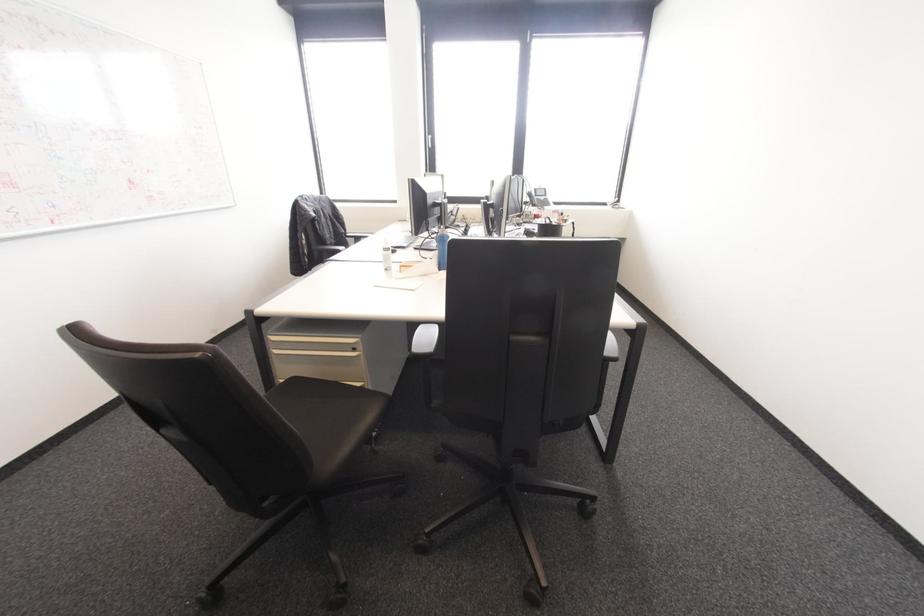
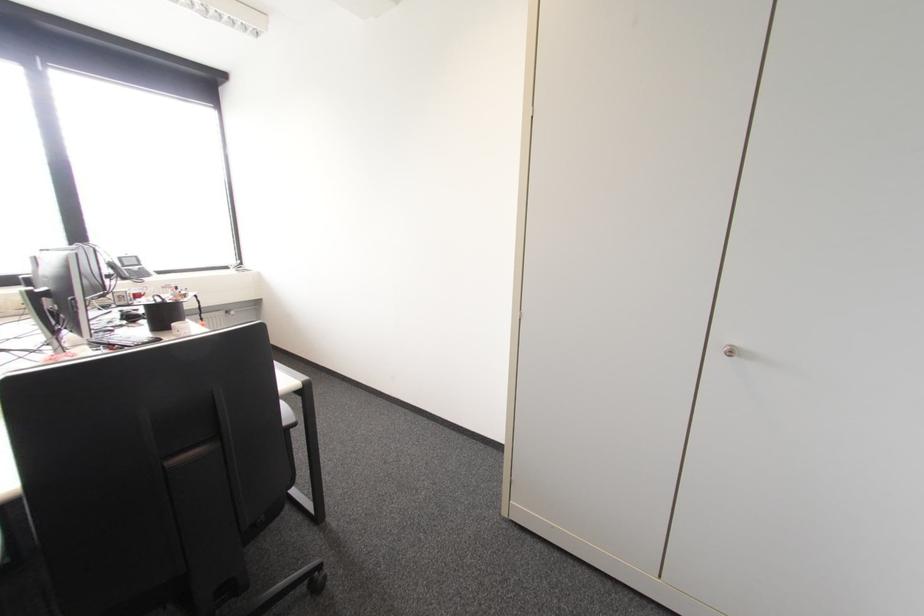
The point at (532, 205) is marked in the first image. Where is the corresponding point in the second image?

(123, 278)